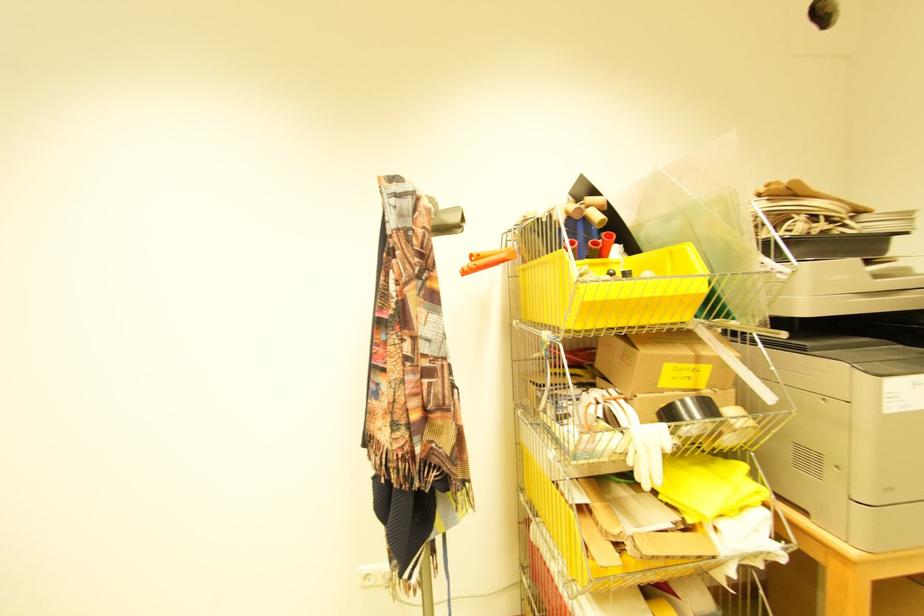
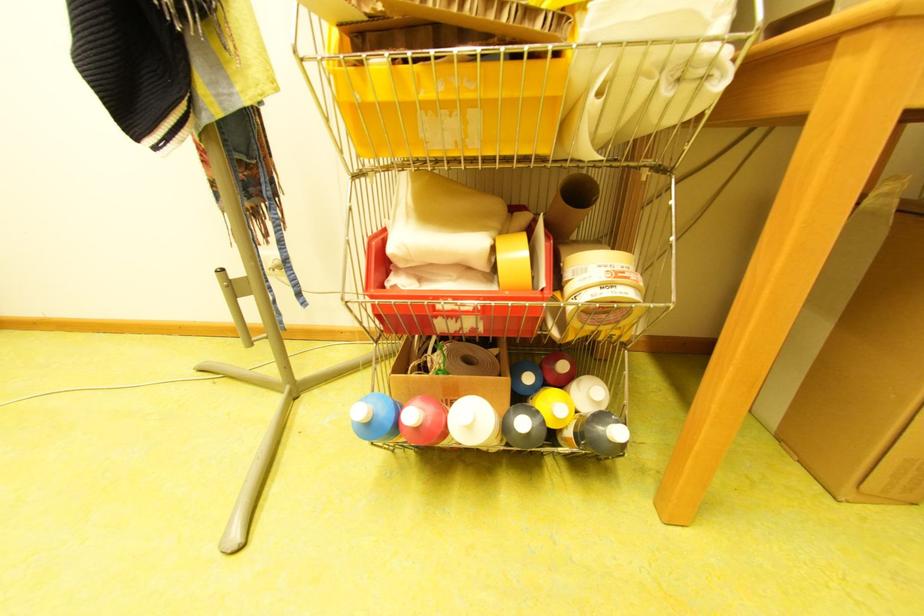
In the scene shown: The images are taken continuously from a first-person perspective. In which direction are you moving?

The movement direction of the cameraman is right, forward.